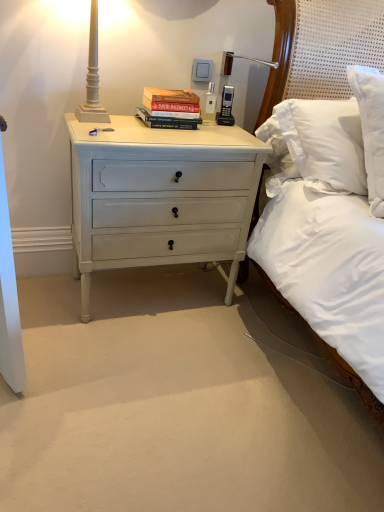
Question: From the image's perspective, is white painted wood nightstand at lower left above matte white lamp at upper left?

Choices:
 (A) no
 (B) yes

Answer: (A)

Question: Is matte white lamp at upper left completely or partially inside white painted wood nightstand at lower left?

Choices:
 (A) yes
 (B) no

Answer: (B)

Question: Is white painted wood nightstand at lower left smaller than matte white lamp at upper left?

Choices:
 (A) no
 (B) yes

Answer: (A)

Question: From the image's perspective, would you say white painted wood nightstand at lower left is shown under matte white lamp at upper left?

Choices:
 (A) no
 (B) yes

Answer: (B)

Question: Is white painted wood nightstand at lower left to the right of matte white lamp at upper left from the viewer's perspective?

Choices:
 (A) no
 (B) yes

Answer: (B)

Question: Is white painted wood nightstand at lower left positioned beyond the bounds of matte white lamp at upper left?

Choices:
 (A) no
 (B) yes

Answer: (B)

Question: Can you confirm if white painted wood nightstand at lower left is thinner than hardcover books at center?

Choices:
 (A) no
 (B) yes

Answer: (A)

Question: Does white painted wood nightstand at lower left lie in front of hardcover books at center?

Choices:
 (A) no
 (B) yes

Answer: (B)

Question: Considering the relative positions of white painted wood nightstand at lower left and hardcover books at center in the image provided, is white painted wood nightstand at lower left behind hardcover books at center?

Choices:
 (A) yes
 (B) no

Answer: (B)

Question: Does white painted wood nightstand at lower left have a greater height compared to hardcover books at center?

Choices:
 (A) no
 (B) yes

Answer: (B)

Question: Can you confirm if white painted wood nightstand at lower left is shorter than hardcover books at center?

Choices:
 (A) no
 (B) yes

Answer: (A)

Question: From a real-world perspective, is white painted wood nightstand at lower left located higher than hardcover books at center?

Choices:
 (A) yes
 (B) no

Answer: (B)

Question: From a real-world perspective, is matte white lamp at upper left physically below white painted wood nightstand at lower left?

Choices:
 (A) no
 (B) yes

Answer: (A)